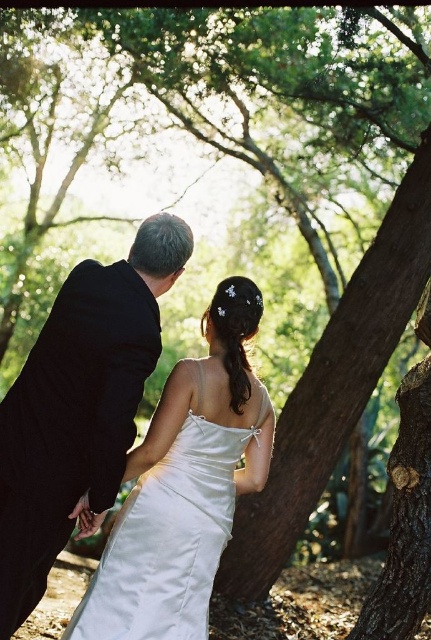
Which is below, black satin suit at left or satin dress at center?

Positioned lower is satin dress at center.

Does point (12, 588) lie behind point (199, 436)?

No, it is in front of (199, 436).

Where is `black satin suit at left`? The width and height of the screenshot is (431, 640). black satin suit at left is located at coordinates (78, 406).